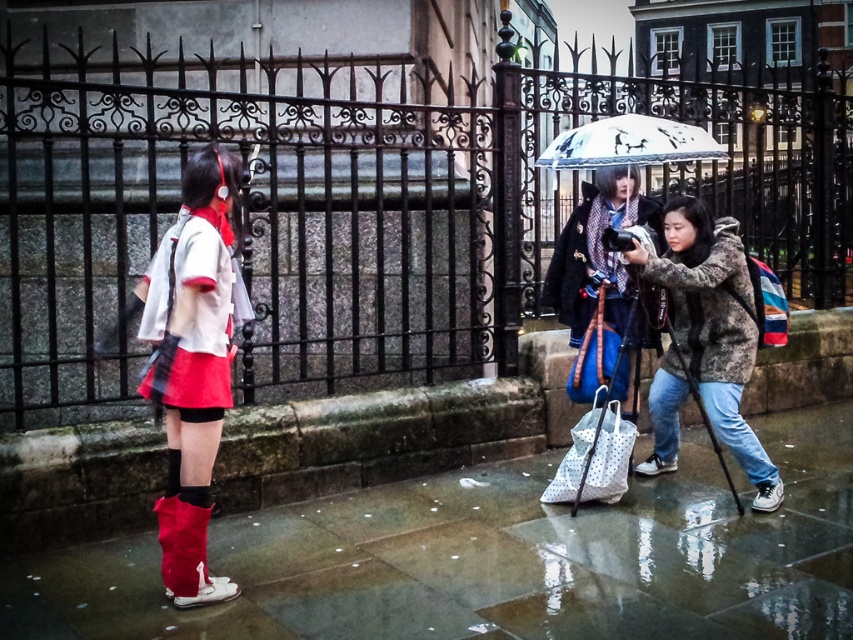
You are a photographer trying to adjust your camera settings. You notice the matte red skirt at left and the camouflage fabric jacket at center in the frame. Which object is located more to the left side of the scene?

The matte red skirt at left is positioned on the left side of the camouflage fabric jacket at center, so it is more to the left in the scene.

You are a photographer trying to capture a clear shot of the matte red skirt at left without the black wrought iron fence at center blocking the view. Based on their heights, is it possible to do so?

The black wrought iron fence at center is taller than matte red skirt at left, so the fence may block the view of the skirt unless the camera is positioned lower or the fence is moved.

Based on the scene description, if you were standing where the camera operator is, which object would be closer to you, the black wrought iron fence at center or the matte red skirt at left?

The black wrought iron fence at center is closer to you than the matte red skirt at left because the black wrought iron fence at center is to the right of matte red skirt at left, implying it is positioned further away from the camera operator.